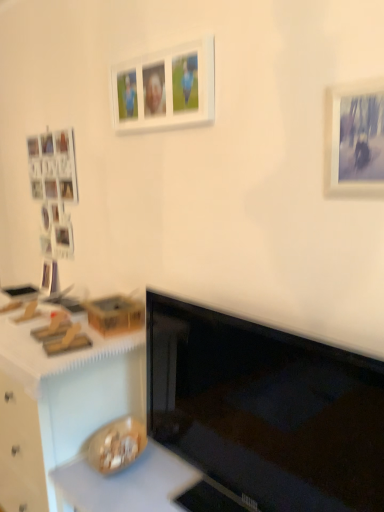
What do you see at coordinates (125, 483) in the screenshot? I see `smooth white countertop at lower center, which is the 2th counter top from top to bottom` at bounding box center [125, 483].

The height and width of the screenshot is (512, 384). What do you see at coordinates (59, 403) in the screenshot? I see `wooden desk at lower left` at bounding box center [59, 403].

You are a GUI agent. You are given a task and a screenshot of the screen. Output one action in this format:
    pyautogui.click(x=<x>, y=<y>)
    Task: Click on the wooden desk at lower left
    
    Given the screenshot: What is the action you would take?
    pyautogui.click(x=59, y=403)

Locate an element on the screen. black glossy monitor at center is located at coordinates (266, 409).

Locate an element on the screen. The image size is (384, 512). white matte picture frame at upper center, which ranks as the first picture frame in left-to-right order is located at coordinates (165, 88).

This screenshot has height=512, width=384. In order to click on matte white picture frame at upper right, acting as the first picture frame starting from the right in this screenshot , I will do `click(355, 139)`.

Measure the distance from white matte picture frame at upper center, acting as the first picture frame starting from the back, to white matte counter top at lower left, arranged as the first counter top when viewed from the top.

90.59 centimeters.

Can you tell me how much white matte picture frame at upper center, which ranks as the first picture frame in left-to-right order, and white matte counter top at lower left, arranged as the second counter top when ordered from the bottom, differ in facing direction?

0.546 degrees separate the facing orientations of white matte picture frame at upper center, which ranks as the first picture frame in left-to-right order, and white matte counter top at lower left, arranged as the second counter top when ordered from the bottom.

Can you confirm if white matte picture frame at upper center, the first picture frame when ordered from top to bottom, is bigger than white matte counter top at lower left, arranged as the second counter top when ordered from the bottom?

No, white matte picture frame at upper center, the first picture frame when ordered from top to bottom, is not bigger than white matte counter top at lower left, arranged as the second counter top when ordered from the bottom.

Where is `the 1st picture frame to the right of the white matte counter top at lower left, arranged as the second counter top when ordered from the bottom, starting your count from the anchor`? The image size is (384, 512). the 1st picture frame to the right of the white matte counter top at lower left, arranged as the second counter top when ordered from the bottom, starting your count from the anchor is located at coordinates (165, 88).

Relative to matte white picture frame at upper right, positioned as the second picture frame in top-to-bottom order, is wooden desk at lower left in front or behind?

In the image, wooden desk at lower left appears behind matte white picture frame at upper right, positioned as the second picture frame in top-to-bottom order.

Can matte white picture frame at upper right, which is the first picture frame from front to back, be found inside wooden desk at lower left?

No, matte white picture frame at upper right, which is the first picture frame from front to back, is located outside of wooden desk at lower left.

Considering the relative sizes of wooden desk at lower left and matte white picture frame at upper right, which is the 1th picture frame from bottom to top, in the image provided, is wooden desk at lower left thinner than matte white picture frame at upper right, which is the 1th picture frame from bottom to top,?

No.

From a real-world perspective, is wooden desk at lower left positioned above or below matte white picture frame at upper right, acting as the first picture frame starting from the right?

Clearly, from a real-world perspective, wooden desk at lower left is below matte white picture frame at upper right, acting as the first picture frame starting from the right.

Is wooden desk at lower left facing away from smooth white countertop at lower center, placed as the 1th counter top when sorted from bottom to top?

No.

Who is taller, wooden desk at lower left or smooth white countertop at lower center, which is the 2th counter top from top to bottom?

wooden desk at lower left.

Is wooden desk at lower left directly adjacent to smooth white countertop at lower center, which is the 2th counter top from top to bottom?

wooden desk at lower left and smooth white countertop at lower center, which is the 2th counter top from top to bottom, are not in contact.

Considering the relative sizes of wooden desk at lower left and smooth white countertop at lower center, which is the 2th counter top from top to bottom, in the image provided, is wooden desk at lower left wider than smooth white countertop at lower center, which is the 2th counter top from top to bottom,?

Yes, wooden desk at lower left is wider than smooth white countertop at lower center, which is the 2th counter top from top to bottom.

Could you measure the distance between white matte picture frame at upper center, the 2th picture frame viewed from the front, and black glossy monitor at center?

white matte picture frame at upper center, the 2th picture frame viewed from the front, is 33.11 inches from black glossy monitor at center.

Between white matte picture frame at upper center, the first picture frame when ordered from top to bottom, and black glossy monitor at center, which one appears on the left side from the viewer's perspective?

Positioned to the left is white matte picture frame at upper center, the first picture frame when ordered from top to bottom.

Is white matte picture frame at upper center, which ranks as the first picture frame in left-to-right order, looking in the opposite direction of black glossy monitor at center?

No, black glossy monitor at center is not at the back of white matte picture frame at upper center, which ranks as the first picture frame in left-to-right order.

Between point (189, 68) and point (271, 434), which one is positioned in front?

Point (271, 434)

From a real-world perspective, who is located lower, matte white picture frame at upper right, acting as the first picture frame starting from the right, or wooden desk at lower left?

From a 3D spatial view, wooden desk at lower left is below.

Considering the positions of points (327, 159) and (55, 451), is point (327, 159) farther from camera compared to point (55, 451)?

No.

Can you confirm if matte white picture frame at upper right, which ranks as the second picture frame in left-to-right order, is taller than wooden desk at lower left?

Incorrect, the height of matte white picture frame at upper right, which ranks as the second picture frame in left-to-right order, is not larger of that of wooden desk at lower left.

From the picture: Is matte white picture frame at upper right, placed as the second picture frame when sorted from back to front, thinner than wooden desk at lower left?

Indeed, matte white picture frame at upper right, placed as the second picture frame when sorted from back to front, has a lesser width compared to wooden desk at lower left.

What are the coordinates of `the 2nd counter top to the left of the matte white picture frame at upper right, acting as the first picture frame starting from the right, starting your count from the anchor` in the screenshot? It's located at (53, 355).

Considering the positions of objects white matte counter top at lower left, arranged as the second counter top when ordered from the bottom, and matte white picture frame at upper right, which ranks as the second picture frame in left-to-right order, in the image provided, who is more to the left, white matte counter top at lower left, arranged as the second counter top when ordered from the bottom, or matte white picture frame at upper right, which ranks as the second picture frame in left-to-right order,?

white matte counter top at lower left, arranged as the second counter top when ordered from the bottom, is more to the left.

Are matte white picture frame at upper right, which is the 1th picture frame from bottom to top, and white matte picture frame at upper center, which ranks as the first picture frame in left-to-right order, far apart?

That's not correct — matte white picture frame at upper right, which is the 1th picture frame from bottom to top, is a little close to white matte picture frame at upper center, which ranks as the first picture frame in left-to-right order.

From the picture: Does matte white picture frame at upper right, acting as the first picture frame starting from the right, appear on the left side of white matte picture frame at upper center, acting as the first picture frame starting from the back?

No, matte white picture frame at upper right, acting as the first picture frame starting from the right, is not to the left of white matte picture frame at upper center, acting as the first picture frame starting from the back.

Could you tell me if matte white picture frame at upper right, which ranks as the second picture frame in left-to-right order, is facing white matte picture frame at upper center, the 2th picture frame viewed from the front?

No, matte white picture frame at upper right, which ranks as the second picture frame in left-to-right order, does not turn towards white matte picture frame at upper center, the 2th picture frame viewed from the front.

Which of these two, matte white picture frame at upper right, placed as the second picture frame when sorted from back to front, or white matte picture frame at upper center, the 2th picture frame viewed from the front, is bigger?

white matte picture frame at upper center, the 2th picture frame viewed from the front.

From the white matte counter top at lower left, arranged as the second counter top when ordered from the bottom, count 1st picture frames forward and point to it. Please provide its 2D coordinates.

[(165, 88)]

Locate an element on the screen. desk behind the matte white picture frame at upper right, acting as the first picture frame starting from the right is located at coordinates (59, 403).

Looking at the image, which one is located further to black glossy monitor at center, smooth white countertop at lower center, which is the 2th counter top from top to bottom, or white matte counter top at lower left, arranged as the second counter top when ordered from the bottom?

white matte counter top at lower left, arranged as the second counter top when ordered from the bottom, is positioned further to the anchor black glossy monitor at center.

Considering their positions, is wooden desk at lower left positioned closer to black glossy monitor at center than matte white picture frame at upper right, acting as the first picture frame starting from the right?

Among the two, wooden desk at lower left is located nearer to black glossy monitor at center.

Based on their spatial positions, is wooden desk at lower left or matte white picture frame at upper right, which ranks as the second picture frame in left-to-right order, closer to white matte picture frame at upper center, which is the 2th picture frame in right-to-left order?

matte white picture frame at upper right, which ranks as the second picture frame in left-to-right order, is closer to white matte picture frame at upper center, which is the 2th picture frame in right-to-left order.

From the image, which object appears to be farther from smooth white countertop at lower center, placed as the 1th counter top when sorted from bottom to top, black glossy monitor at center or wooden desk at lower left?

The object further to smooth white countertop at lower center, placed as the 1th counter top when sorted from bottom to top, is black glossy monitor at center.

Considering their positions, is white matte counter top at lower left, arranged as the first counter top when viewed from the top, positioned closer to wooden desk at lower left than white matte picture frame at upper center, the first picture frame when ordered from top to bottom?

white matte counter top at lower left, arranged as the first counter top when viewed from the top, lies closer to wooden desk at lower left than the other object.

Considering their positions, is white matte counter top at lower left, arranged as the first counter top when viewed from the top, positioned closer to matte white picture frame at upper right, which ranks as the second picture frame in left-to-right order, than white matte picture frame at upper center, acting as the first picture frame starting from the back?

Among the two, white matte picture frame at upper center, acting as the first picture frame starting from the back, is located nearer to matte white picture frame at upper right, which ranks as the second picture frame in left-to-right order.

When comparing their distances from matte white picture frame at upper right, placed as the second picture frame when sorted from back to front, does wooden desk at lower left or white matte picture frame at upper center, acting as the first picture frame starting from the back, seem further?

wooden desk at lower left lies further to matte white picture frame at upper right, placed as the second picture frame when sorted from back to front, than the other object.

Which object lies further to the anchor point white matte counter top at lower left, arranged as the first counter top when viewed from the top, matte white picture frame at upper right, which is the first picture frame from front to back, or wooden desk at lower left?

Based on the image, matte white picture frame at upper right, which is the first picture frame from front to back, appears to be further to white matte counter top at lower left, arranged as the first counter top when viewed from the top.

The image size is (384, 512). I want to click on computer monitor between white matte counter top at lower left, arranged as the second counter top when ordered from the bottom, and matte white picture frame at upper right, which is the first picture frame from front to back, from left to right, so click(266, 409).

Identify the location of counter top located between white matte counter top at lower left, arranged as the first counter top when viewed from the top, and black glossy monitor at center in the left-right direction. (125, 483).

I want to click on desk between white matte counter top at lower left, arranged as the first counter top when viewed from the top, and smooth white countertop at lower center, placed as the 1th counter top when sorted from bottom to top, vertically, so click(x=59, y=403).

Locate an element on the screen. The height and width of the screenshot is (512, 384). counter top between white matte picture frame at upper center, acting as the first picture frame starting from the back, and wooden desk at lower left from top to bottom is located at coordinates [53, 355].